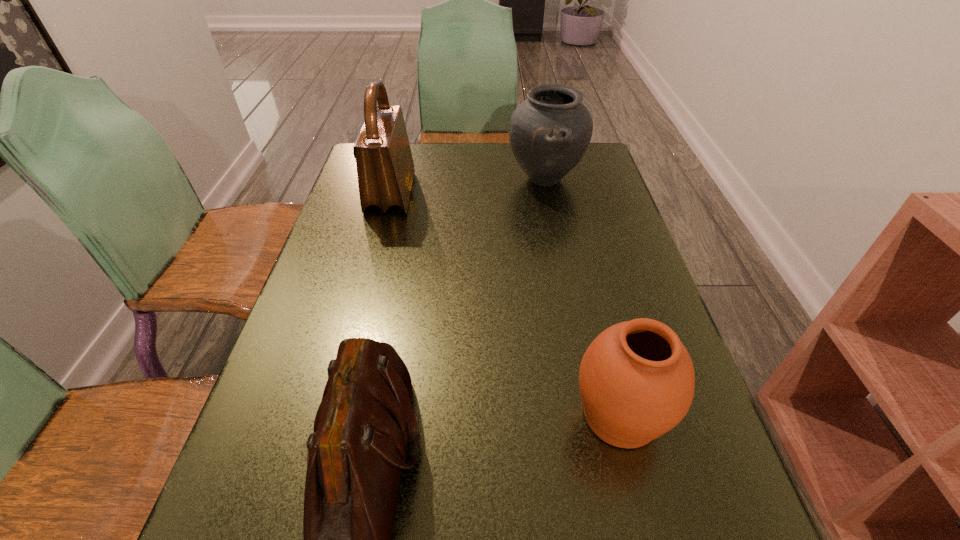
Select which object is the closest to the nearer shoulder bag. Please provide its 2D coordinates. Your answer should be formatted as a tuple, i.e. [(x, y)], where the tuple contains the x and y coordinates of a point satisfying the conditions above.

[(636, 379)]

Where is `free space in the image that satisfies the following two spatial constraints: 1. on the front flap of the shortest object; 2. on the right side of the tallest object`? free space in the image that satisfies the following two spatial constraints: 1. on the front flap of the shortest object; 2. on the right side of the tallest object is located at coordinates (334, 415).

What are the coordinates of `free region that satisfies the following two spatial constraints: 1. on the front flap of the tallest object; 2. on the right side of the nearer urn` in the screenshot? It's located at point(334,415).

The height and width of the screenshot is (540, 960). Find the location of `vacant area in the image that satisfies the following two spatial constraints: 1. on the front side of the shortest object; 2. on the left side of the farther urn`. vacant area in the image that satisfies the following two spatial constraints: 1. on the front side of the shortest object; 2. on the left side of the farther urn is located at coordinates (591, 415).